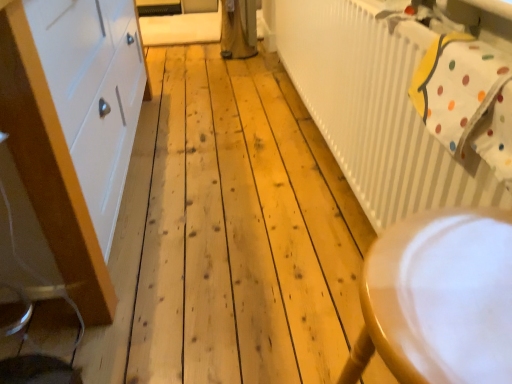
Question: Considering the relative positions of white polka dot fabric at upper right and white painted wood cabinet at left in the image provided, is white polka dot fabric at upper right in front of white painted wood cabinet at left?

Choices:
 (A) yes
 (B) no

Answer: (B)

Question: From a real-world perspective, is white polka dot fabric at upper right located beneath white painted wood cabinet at left?

Choices:
 (A) yes
 (B) no

Answer: (B)

Question: Is white polka dot fabric at upper right taller than white painted wood cabinet at left?

Choices:
 (A) yes
 (B) no

Answer: (B)

Question: Are white polka dot fabric at upper right and white painted wood cabinet at left located far from each other?

Choices:
 (A) yes
 (B) no

Answer: (B)

Question: Considering the relative sizes of white polka dot fabric at upper right and white painted wood cabinet at left in the image provided, is white polka dot fabric at upper right shorter than white painted wood cabinet at left?

Choices:
 (A) yes
 (B) no

Answer: (A)

Question: Considering the positions of point (438, 102) and point (373, 52), is point (438, 102) closer or farther from the camera than point (373, 52)?

Choices:
 (A) closer
 (B) farther

Answer: (A)

Question: Is white polka dot fabric at upper right inside or outside of white ribbed radiator at upper right?

Choices:
 (A) outside
 (B) inside

Answer: (B)

Question: From the image's perspective, relative to white ribbed radiator at upper right, is white polka dot fabric at upper right above or below?

Choices:
 (A) below
 (B) above

Answer: (A)

Question: In terms of height, does white polka dot fabric at upper right look taller or shorter compared to white ribbed radiator at upper right?

Choices:
 (A) short
 (B) tall

Answer: (A)

Question: In terms of width, does white polka dot fabric at upper right look wider or thinner when compared to white painted wood cabinet at left?

Choices:
 (A) wide
 (B) thin

Answer: (B)

Question: From the image's perspective, is white polka dot fabric at upper right above or below white painted wood cabinet at left?

Choices:
 (A) above
 (B) below

Answer: (B)

Question: From their relative heights in the image, would you say white polka dot fabric at upper right is taller or shorter than white painted wood cabinet at left?

Choices:
 (A) tall
 (B) short

Answer: (B)

Question: Is white polka dot fabric at upper right inside or outside of white painted wood cabinet at left?

Choices:
 (A) outside
 (B) inside

Answer: (A)

Question: Considering the positions of white painted wood cabinet at left and white polka dot fabric at upper right in the image, is white painted wood cabinet at left wider or thinner than white polka dot fabric at upper right?

Choices:
 (A) thin
 (B) wide

Answer: (B)

Question: Considering the positions of white painted wood cabinet at left and white polka dot fabric at upper right in the image, is white painted wood cabinet at left taller or shorter than white polka dot fabric at upper right?

Choices:
 (A) tall
 (B) short

Answer: (A)